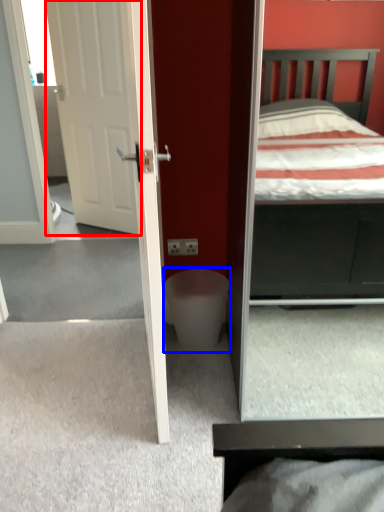
Question: Which of the following is the closest to the observer, door (highlighted by a red box) or toilet bowl (highlighted by a blue box)?

Choices:
 (A) door
 (B) toilet bowl

Answer: (B)